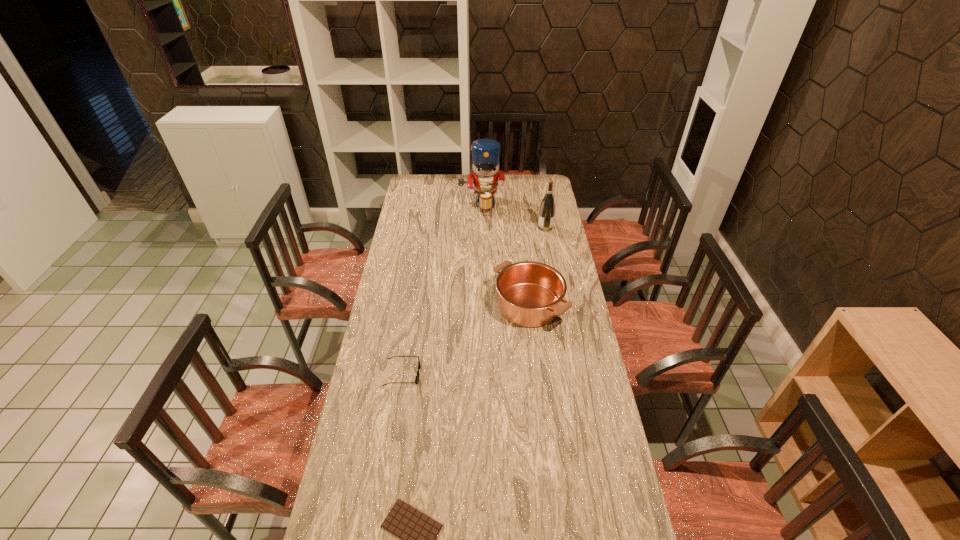
In the image, there is a desktop. Where is `vacant space at the right edge`? vacant space at the right edge is located at coordinates (569, 377).

The height and width of the screenshot is (540, 960). In the image, there is a desktop. What are the coordinates of `vacant space at the far left corner` in the screenshot? It's located at (414, 177).

Image resolution: width=960 pixels, height=540 pixels. I want to click on free space between the fourth farthest object and the third farthest object, so click(466, 339).

This screenshot has height=540, width=960. Find the location of `empty space that is in between the spectacles and the third shortest object`. empty space that is in between the spectacles and the third shortest object is located at coordinates (466, 339).

Find the location of `empty space that is in between the nutcracker and the second farthest object`. empty space that is in between the nutcracker and the second farthest object is located at coordinates (514, 215).

This screenshot has width=960, height=540. I want to click on object that stands as the closest to the second nearest object, so pos(530,294).

The width and height of the screenshot is (960, 540). Identify the location of object that is the third closest one to the fourth tallest object. (547, 208).

This screenshot has width=960, height=540. Identify the location of vacant space that satisfies the following two spatial constraints: 1. on the front-facing side of the nutcracker; 2. on the front-facing side of the second nearest object. (482, 374).

You are a GUI agent. You are given a task and a screenshot of the screen. Output one action in this format:
    pyautogui.click(x=<x>, y=<y>)
    Task: Click on the free region that satisfies the following two spatial constraints: 1. on the front-facing side of the nutcracker; 2. on the front-facing side of the fourth tallest object
    Image resolution: width=960 pixels, height=540 pixels.
    Given the screenshot: What is the action you would take?
    pyautogui.click(x=482, y=374)